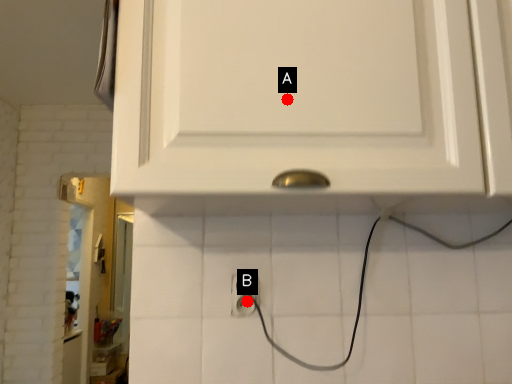
Question: Two points are circled on the image, labeled by A and B beside each circle. Which point is closer to the camera?

Choices:
 (A) A is closer
 (B) B is closer

Answer: (A)